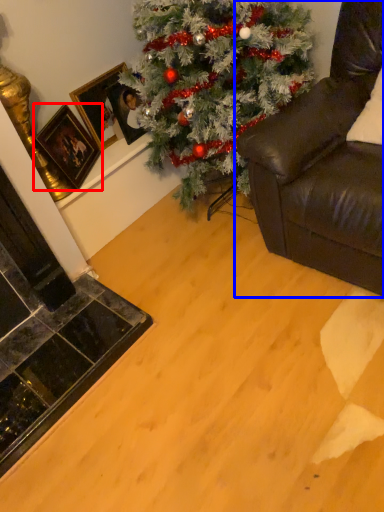
Question: Which point is further to the camera, picture frame (highlighted by a red box) or studio couch (highlighted by a blue box)?

Choices:
 (A) picture frame
 (B) studio couch

Answer: (A)